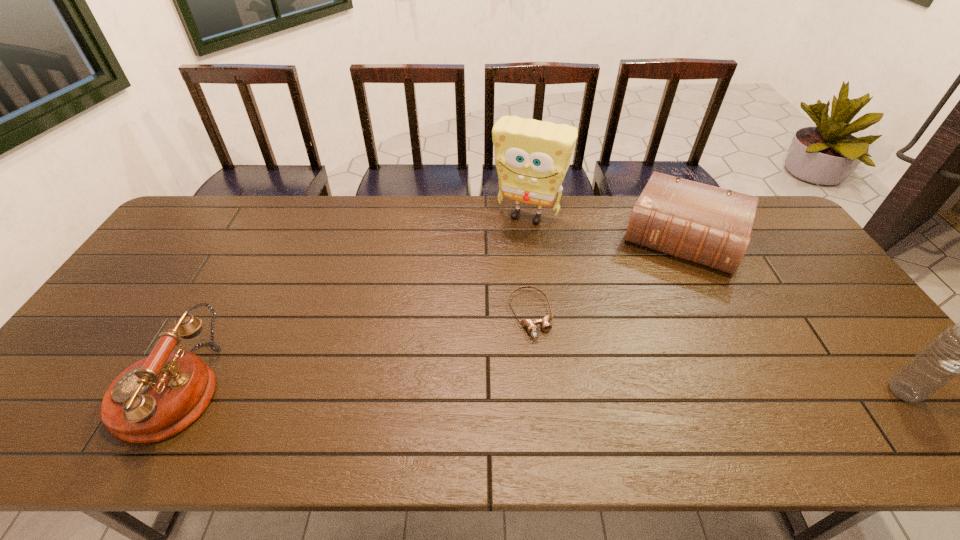
Identify the location of free space on the desktop that is between the telephone and the second tallest object and is positioned on the front lenses and sides of the shortest object. This screenshot has height=540, width=960. (562, 391).

The image size is (960, 540). I want to click on vacant space on the desktop that is between the telephone and the water bottle and is positioned on the spine side of the Bible, so (x=624, y=392).

Locate an element on the screen. The width and height of the screenshot is (960, 540). free spot on the desktop that is between the third tallest object and the second tallest object and is positioned on the face of the sponge is located at coordinates (439, 391).